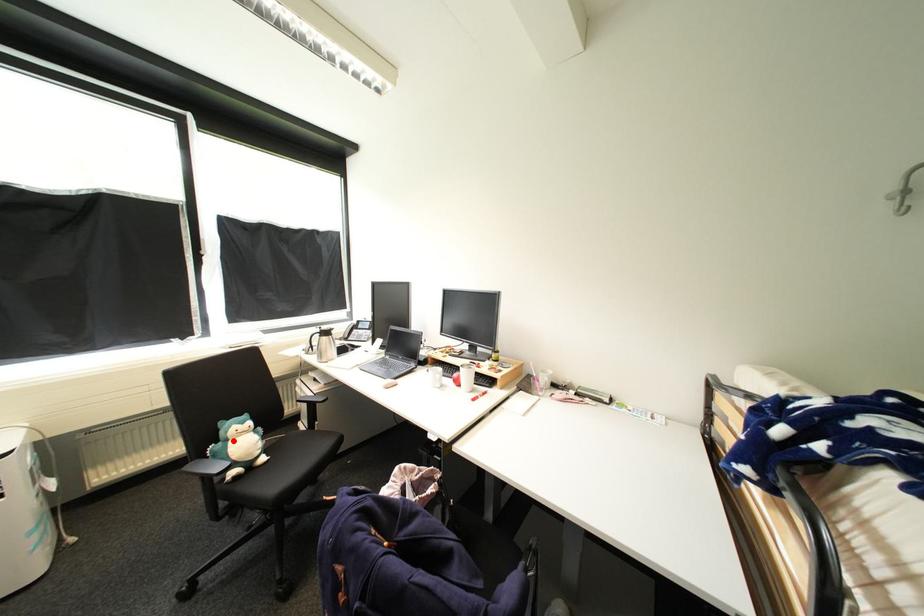
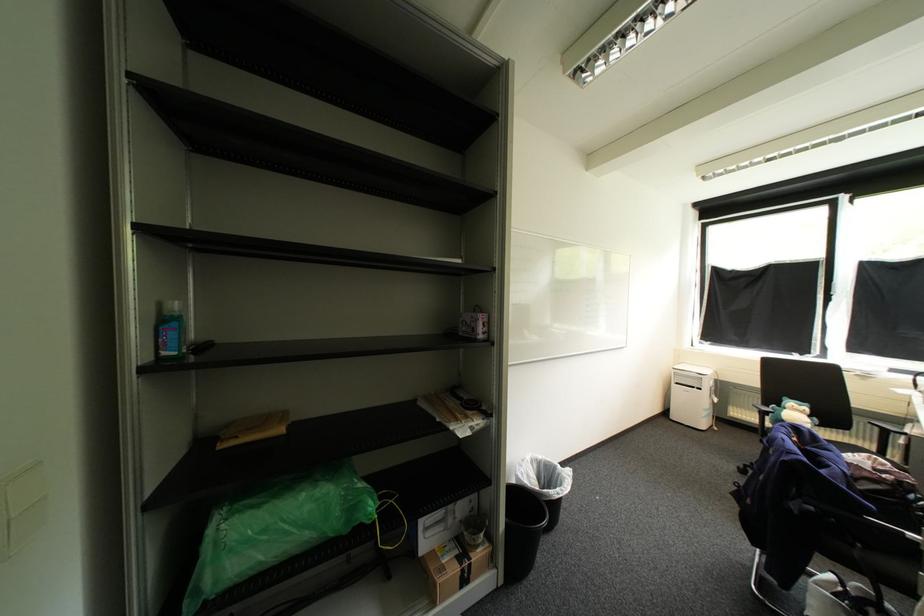
Question: I am providing you with two images of the same scene from different viewpoints. A red point is marked on the first image. At the location where the point appears in image 1, is it still visible in image 2?

Choices:
 (A) Yes
 (B) No

Answer: (A)